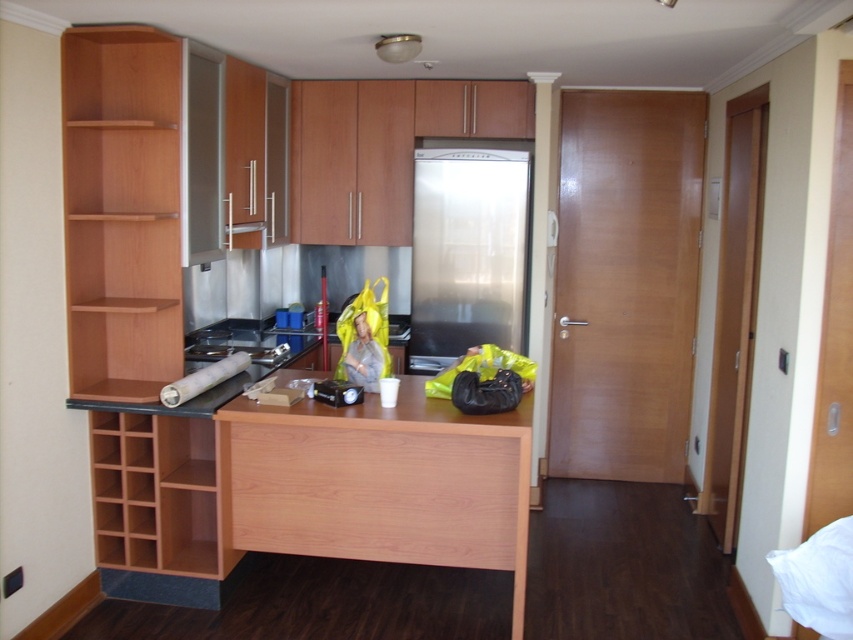
You are organizing the kitchen and need to place a large appliance that requires 2 square feet of space. You have the light wood drawer at center and the stainless steel refrigerator at center in view. Which object can accommodate the appliance based on their sizes?

The light wood drawer at center has a larger size compared to the stainless steel refrigerator at center, so it can accommodate the large appliance needing 2 square feet of space.

You are organizing the kitchen and need to place a new spice jar. The spice jar requires a shelf that is at least 0.2 meters in height. Can the light brown wood shelf at left accommodate the spice jar based on its position?

The light brown wood shelf at left is located at point (120, 211), but the height requirement for the spice jar is not specified in the objects description. Therefore, it is unclear if the shelf can accommodate the spice jar based on the given information.

From the picture: You are organizing a dinner party and need to place a large platter on the counter. Given that the light brown wood shelf at left and the brushed metal sink at center are in the way, which one do you need to move to make space?

You need to move the brushed metal sink at center because the light brown wood shelf at left has a lesser width and thus occupies less space, making the sink the larger obstruction.